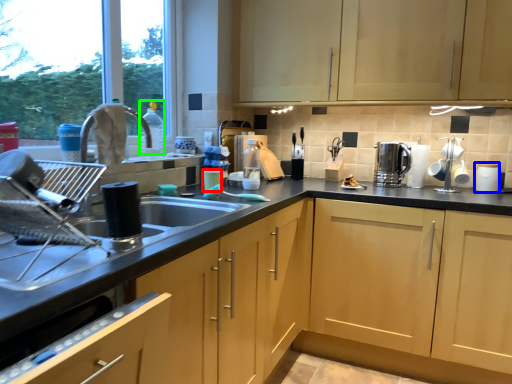
Question: Which object is positioned closest to appliance (highlighted by a red box)? Select from appliance (highlighted by a blue box) and bottle (highlighted by a green box).

Choices:
 (A) appliance
 (B) bottle

Answer: (B)